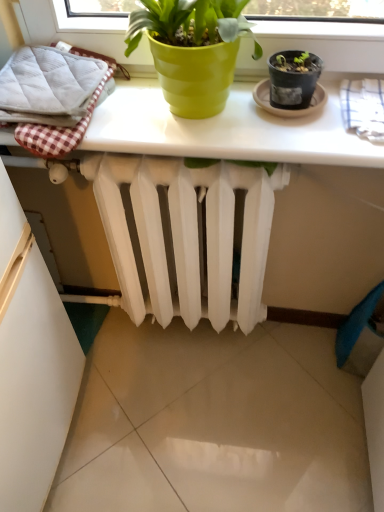
Question: Is point (213, 274) positioned closer to the camera than point (110, 137)?

Choices:
 (A) closer
 (B) farther

Answer: (B)

Question: Looking at their shapes, would you say white matte radiator at center is wider or thinner than white glossy table at upper center?

Choices:
 (A) thin
 (B) wide

Answer: (A)

Question: Which object is positioned closest to the white matte radiator at center?

Choices:
 (A) white checkered bath towel at upper right, positioned as the second bath towel in left-to-right order
 (B) white quilted bath towel at left, the second bath towel viewed from the right
 (C) white glossy table at upper center

Answer: (C)

Question: Based on their relative distances, which object is farther from the white checkered bath towel at upper right, positioned as the first bath towel in right-to-left order?

Choices:
 (A) white quilted bath towel at left, acting as the 1th bath towel starting from the left
 (B) white glossy table at upper center
 (C) white matte radiator at center

Answer: (A)